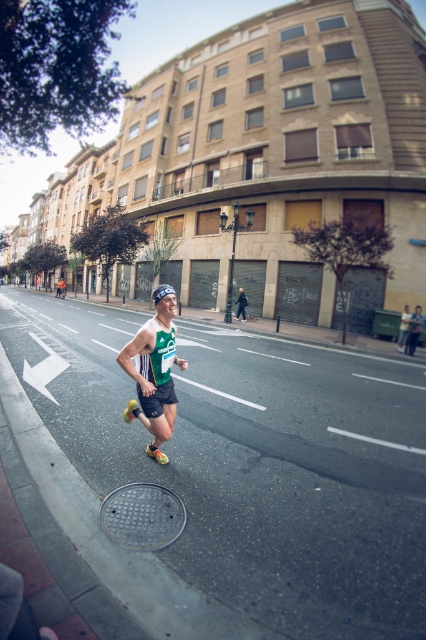
You are a photographer standing on the sidewalk and want to take a photo of the green fabric runner at center and the gray metallic manhole cover at lower center. Which object will appear narrower in your photo?

The green fabric runner at center will appear narrower in the photo because it is thinner than the gray metallic manhole cover at lower center.

You are a drone operator trying to capture the runner in the center of the image. The drone is currently at the point with coordinates [154,371]. Can you confirm if the green fabric runner at center is exactly at this point?

The green fabric runner at center is represented by point [154,371], so yes, the drone is exactly at the location of the green fabric runner at center.

Based on the photo, you are a drone operator tasked with capturing aerial footage of the marathon. The green fabric runner at center is currently at point 0.581, 0.362 on the coordinate system. If you need to adjust your drone to focus on this runner, which direction should you move the drone relative to the current position?

The green fabric runner at center is located at point (154, 371), so you should move the drone to that coordinate to focus on the runner.